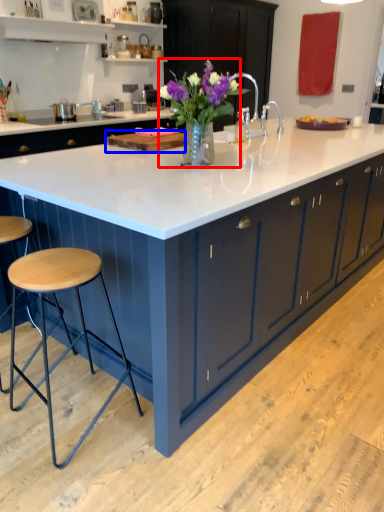
Question: Among these objects, which one is nearest to the camera, floral arrangement (highlighted by a red box) or wood (highlighted by a blue box)?

Choices:
 (A) floral arrangement
 (B) wood

Answer: (A)